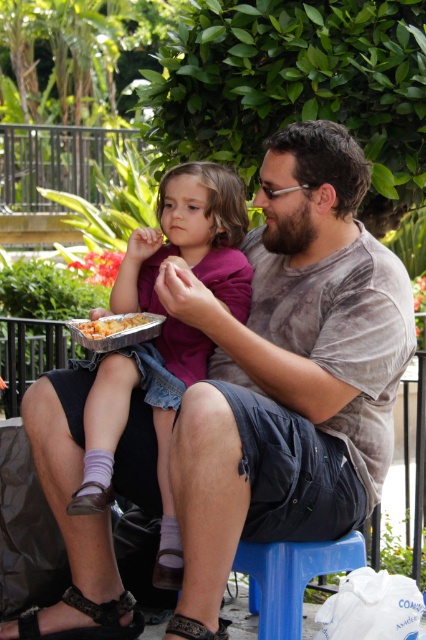
Question: Estimate the real-world distances between objects in this image. Which object is closer to the leather/black at lower left?

Choices:
 (A) purple matte shirt at center
 (B) leather sandal at lower center

Answer: (B)

Question: Which point is farther to the camera?

Choices:
 (A) (132, 356)
 (B) (221, 630)
 (C) (83, 324)
 (D) (63, 632)

Answer: (D)

Question: Can you confirm if purple matte shirt at center is positioned to the left of golden crispy fries at center?

Choices:
 (A) no
 (B) yes

Answer: (A)

Question: Considering the relative positions of purple matte shirt at center and leather sandal at lower center in the image provided, where is purple matte shirt at center located with respect to leather sandal at lower center?

Choices:
 (A) right
 (B) left

Answer: (B)

Question: Which is nearer to the golden crispy fries at center?

Choices:
 (A) purple matte shirt at center
 (B) leather/black at lower left
 (C) leather sandal at lower center

Answer: (A)

Question: Does golden crispy fries at center lie in front of leather sandal at lower center?

Choices:
 (A) yes
 (B) no

Answer: (B)